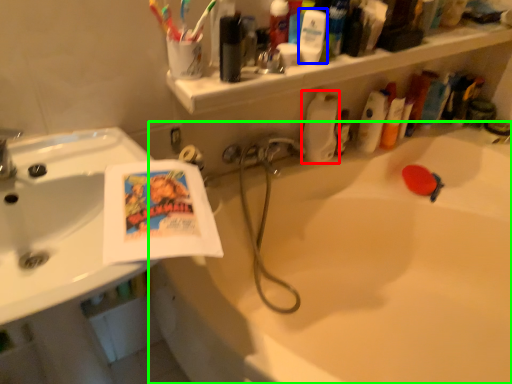
Question: Based on their relative distances, which object is farther from cleaning product (highlighted by a red box)? Choose from mouthwash (highlighted by a blue box) and bathtub (highlighted by a green box).

Choices:
 (A) mouthwash
 (B) bathtub

Answer: (B)